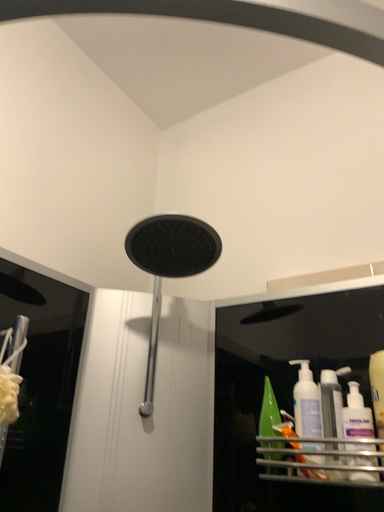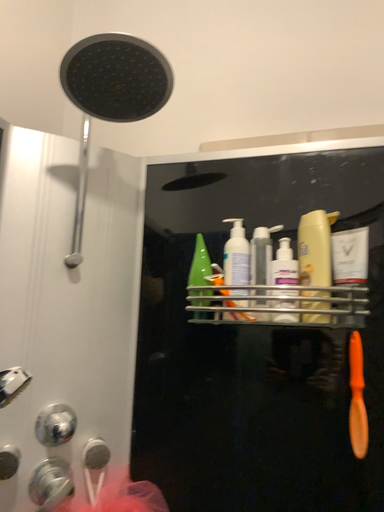
Question: Which way did the camera rotate in the video?

Choices:
 (A) rotated downward
 (B) rotated upward

Answer: (A)